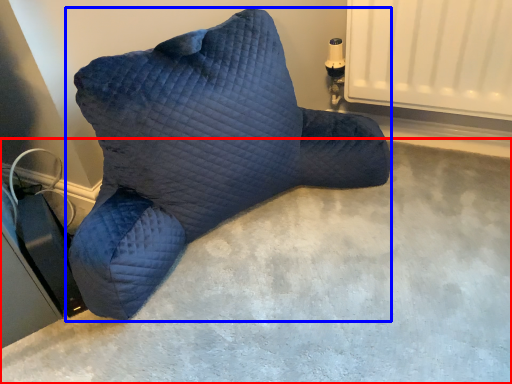
Question: Which object is closer to the camera taking this photo, concrete (highlighted by a red box) or furniture (highlighted by a blue box)?

Choices:
 (A) concrete
 (B) furniture

Answer: (A)